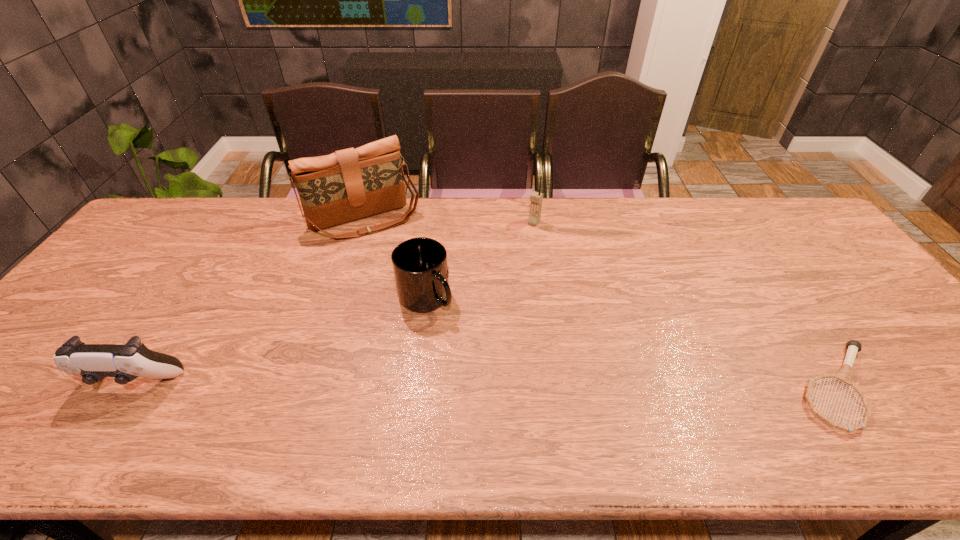
Locate an element on the screen. The image size is (960, 540). tennis racket located at the near edge is located at coordinates (844, 376).

Identify the location of vacant space at the far edge of the desktop. The height and width of the screenshot is (540, 960). [x=642, y=214].

Find the location of a particular element. vacant space at the near edge is located at coordinates (177, 381).

You are a GUI agent. You are given a task and a screenshot of the screen. Output one action in this format:
    pyautogui.click(x=<x>, y=<y>)
    Task: Click on the vacant area at the left edge
    The width and height of the screenshot is (960, 540).
    Given the screenshot: What is the action you would take?
    pyautogui.click(x=145, y=245)

Find the location of a particular element. The image size is (960, 540). vacant space at the right edge of the desktop is located at coordinates (836, 265).

Locate an element on the screen. This screenshot has width=960, height=540. vacant region at the far left corner of the desktop is located at coordinates (182, 199).

Identify the location of vacant space at the far right corner. This screenshot has height=540, width=960. (793, 237).

Where is `empty location between the cellular telephone and the control`? This screenshot has width=960, height=540. empty location between the cellular telephone and the control is located at coordinates (334, 302).

At what (x,y) coordinates should I click in order to perform the action: click on vacant area between the shortest object and the control. Please return your answer as a coordinate pair (x, y). Looking at the image, I should click on (486, 385).

Where is `free space between the second tallest object and the shoulder bag`? The image size is (960, 540). free space between the second tallest object and the shoulder bag is located at coordinates (449, 221).